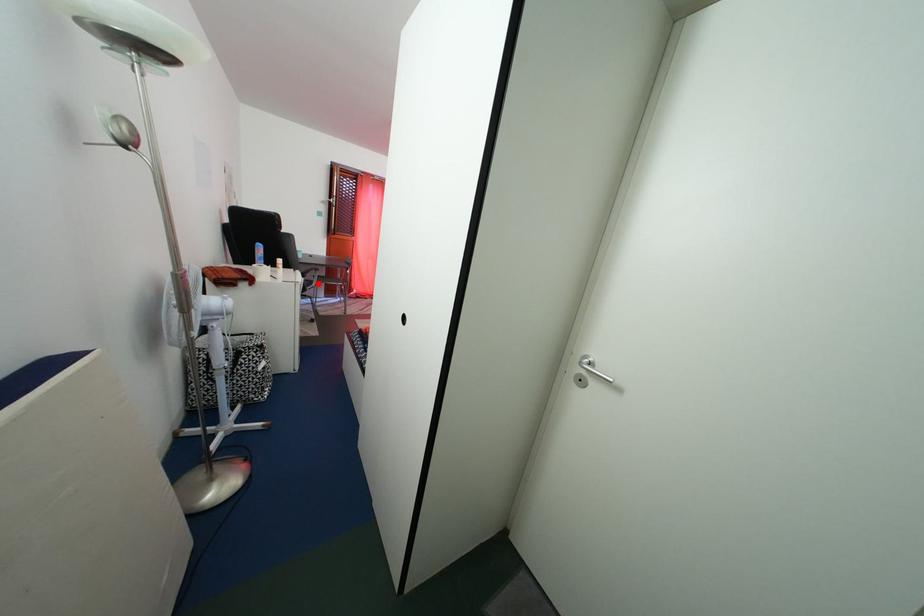
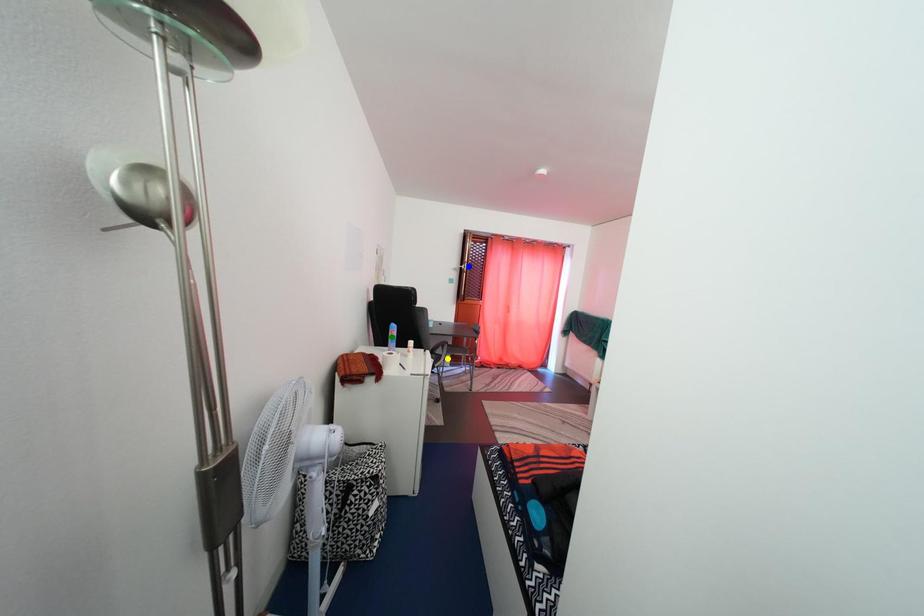
Question: I am providing you with two images of the same scene from different viewpoints. A red point is marked on the first image. You are given multiple points on the second image. In image 2, which mark is for the same physical point as the one in image 1?

Choices:
 (A) green point
 (B) yellow point
 (C) blue point

Answer: (B)